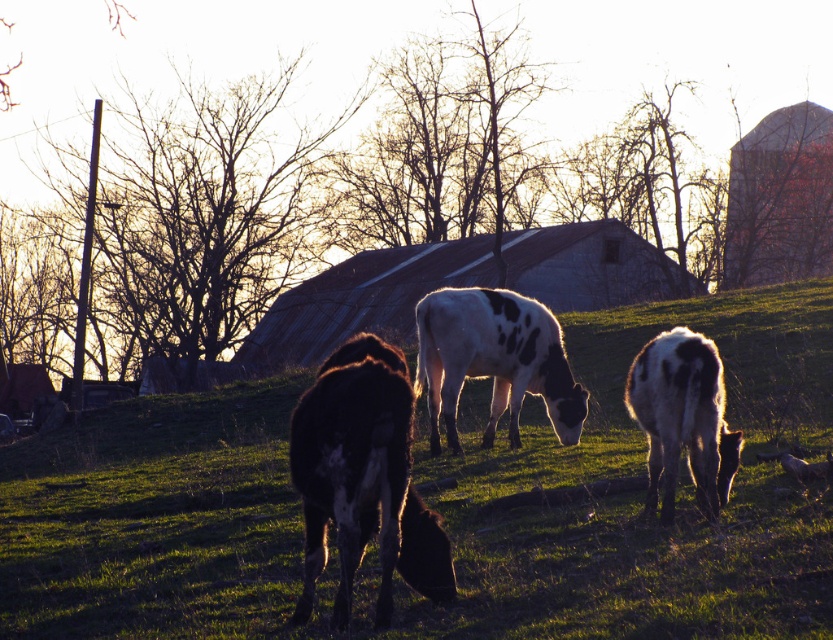
Question: Which object is positioned farthest from the black glossy cow at center?

Choices:
 (A) white-spotted fur calf at lower right
 (B) green grassy at center
 (C) white spotted cow at center

Answer: (B)

Question: Which point appears closest to the camera in this image?

Choices:
 (A) (555, 477)
 (B) (686, 388)

Answer: (B)

Question: Is black glossy cow at center positioned behind white spotted cow at center?

Choices:
 (A) no
 (B) yes

Answer: (A)

Question: Which is farther from the black glossy cow at center?

Choices:
 (A) white spotted cow at center
 (B) white-spotted fur calf at lower right
 (C) green grassy at center

Answer: (C)

Question: Observing the image, what is the correct spatial positioning of green grassy at center in reference to white spotted cow at center?

Choices:
 (A) left
 (B) right

Answer: (B)

Question: Can you confirm if black glossy cow at center is thinner than white spotted cow at center?

Choices:
 (A) no
 (B) yes

Answer: (B)